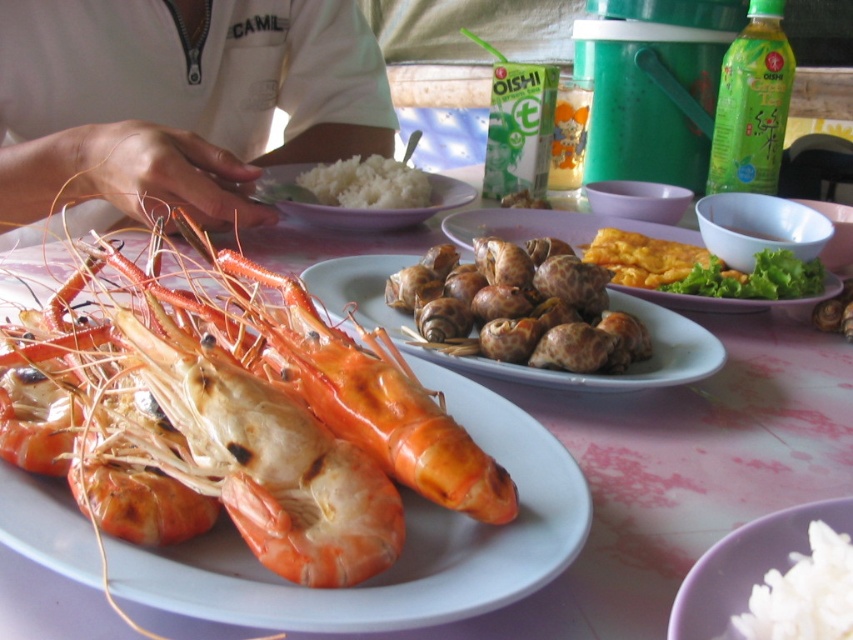
You are a guest at a dinner party and want to reach for the brown textured snails at center without touching the white matte shirt at upper left. Which direction should you move your hand to avoid it?

The white matte shirt at upper left is to the left of the brown textured snails at center, so you should move your hand to the right to avoid it.

You are looking at the table with the pinkish tablecloth and see two points marked on it. Which point is closer to you, point (379, 417) or point (679, 269)?

Point (379, 417) is closer to the viewer than point (679, 269).

You are a diner sitting at the smooth white table at center and want to reach the yellowish fried egg at center right. Which direction should you move your hand to grab it?

The smooth white table at center is below the yellowish fried egg at center right, so you should move your hand upward to reach the yellowish fried egg at center right.